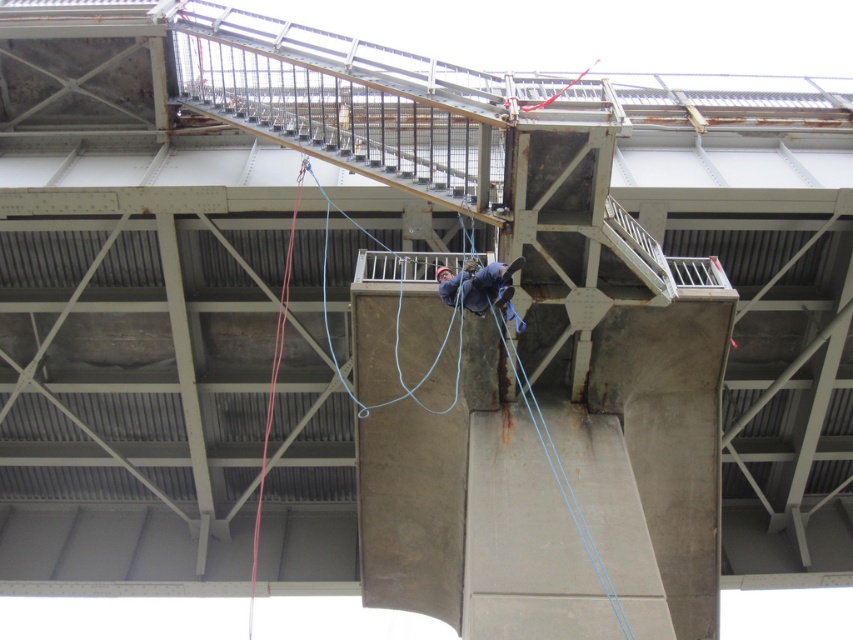
Can you confirm if concrete/stained at center is positioned below blue fabric harness at center?

Yes.

Is concrete/stained at center in front of blue fabric harness at center?

No, concrete/stained at center is further to the viewer.

Between point (634, 632) and point (497, 301), which one is positioned in front?

Point (634, 632) is in front.

The height and width of the screenshot is (640, 853). What are the coordinates of `concrete/stained at center` in the screenshot? It's located at (555, 531).

Does point (271, 420) lie behind point (461, 275)?

Yes, it is behind point (461, 275).

Identify the location of red nylon rope at center. The width and height of the screenshot is (853, 640). (273, 387).

Identify the location of red nylon rope at center. The height and width of the screenshot is (640, 853). (273, 387).

Does point (647, 636) come closer to viewer compared to point (265, 412)?

Yes, point (647, 636) is closer to viewer.

The height and width of the screenshot is (640, 853). What are the coordinates of `concrete/stained at center` in the screenshot? It's located at (555, 531).